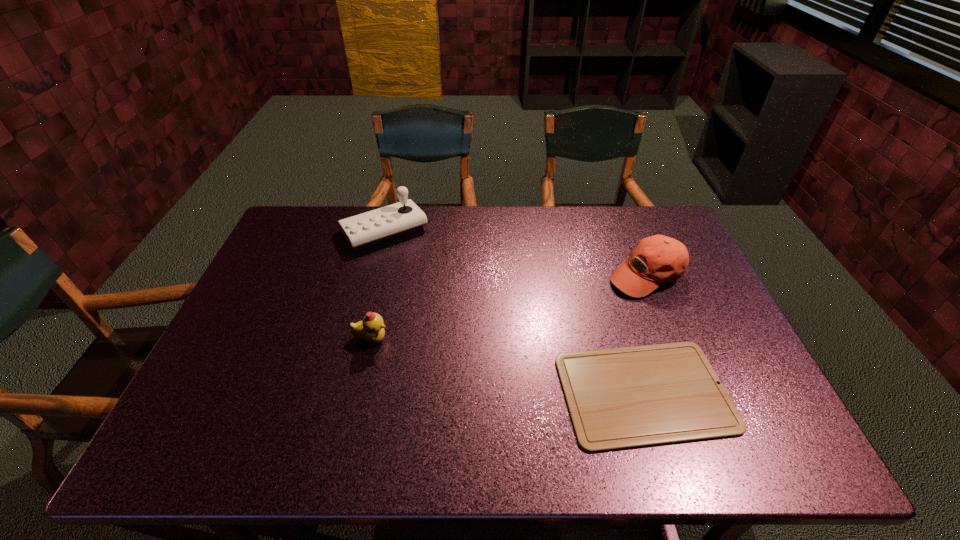
At what (x,y) coordinates should I click in order to perform the action: click on vacant space that is in between the second shortest object and the chopping board. Please return your answer as a coordinate pair (x, y). Looking at the image, I should click on (508, 366).

Image resolution: width=960 pixels, height=540 pixels. What are the coordinates of `free area in between the joystick and the shortest object` in the screenshot? It's located at (515, 312).

Locate an element on the screen. unoccupied position between the shortest object and the duckling is located at coordinates (508, 366).

Locate an element on the screen. free area in between the baseball cap and the joystick is located at coordinates (516, 253).

Locate an element on the screen. The height and width of the screenshot is (540, 960). free space between the joystick and the baseball cap is located at coordinates (516, 253).

Locate an element on the screen. unoccupied area between the chopping board and the joystick is located at coordinates (515, 312).

Locate an element on the screen. This screenshot has width=960, height=540. free space that is in between the duckling and the shortest object is located at coordinates (508, 366).

At what (x,y) coordinates should I click in order to perform the action: click on free spot between the shortest object and the duckling. Please return your answer as a coordinate pair (x, y). The image size is (960, 540). Looking at the image, I should click on (508, 366).

At what (x,y) coordinates should I click in order to perform the action: click on vacant area that lies between the chopping board and the baseball cap. Please return your answer as a coordinate pair (x, y). The height and width of the screenshot is (540, 960). Looking at the image, I should click on (645, 334).

The width and height of the screenshot is (960, 540). Find the location of `the third closest object relative to the shortest object`. the third closest object relative to the shortest object is located at coordinates (373, 227).